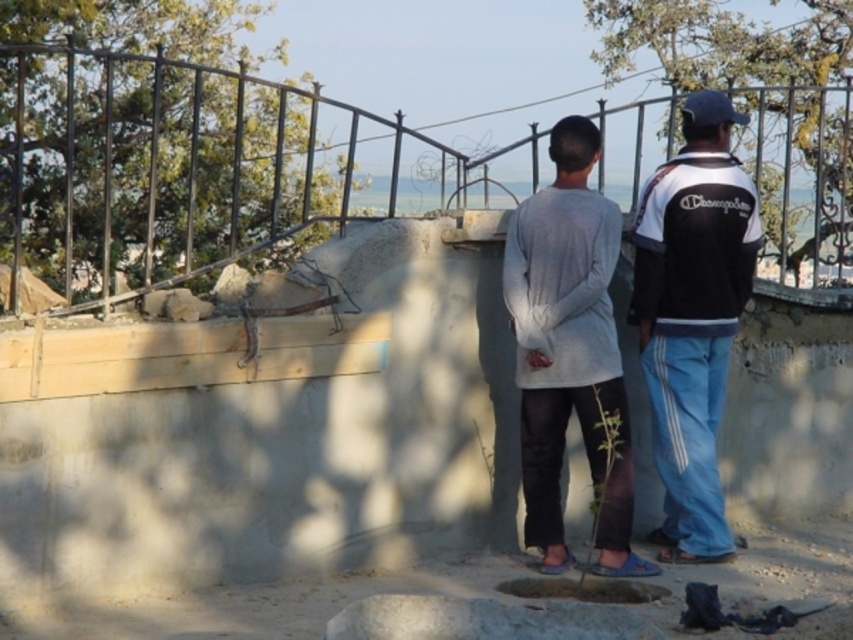
You are standing on the platform and want to take a photo of the black and white track suit at right without including the metallic wire fence at upper center in the frame. Is it possible to do so by moving your camera upwards?

The metallic wire fence at upper center is above the black and white track suit at right, so moving the camera upwards would include the fence in the frame. Therefore, it is not possible to exclude the metallic wire fence at upper center while capturing the black and white track suit at right by moving the camera upwards.

Consider the image. You are a photographer trying to capture a photo of both the black and white track suit at right and the gray matte shirt at center. Since you want both subjects to be in focus, you need to know which one is closer to the camera. According to the scene description, which person is closer?

The black and white track suit at right is taller than the gray matte shirt at center, so the black and white track suit at right is closer to the camera.